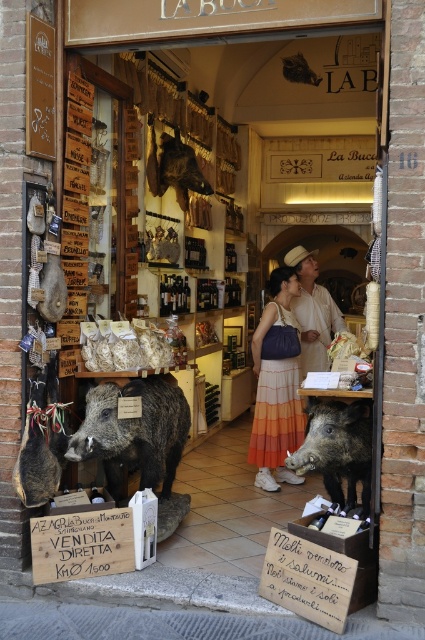
In the scene shown: You are a customer standing outside the shop entrance. You see both the dark brown fur wild boar at center and the light beige straw hat at center displayed in the shop window. Which item is closer to you?

The dark brown fur wild boar at center is closer to the viewer than the light beige straw hat at center, so the dark brown fur wild boar at center is closer to you.

You are a customer entering the shop and notice the light beige straw hat at center and the shiny brown leather bag at upper center. Which item is positioned lower in the display?

The light beige straw hat at center is positioned below the shiny brown leather bag at upper center, so it is lower in the display.